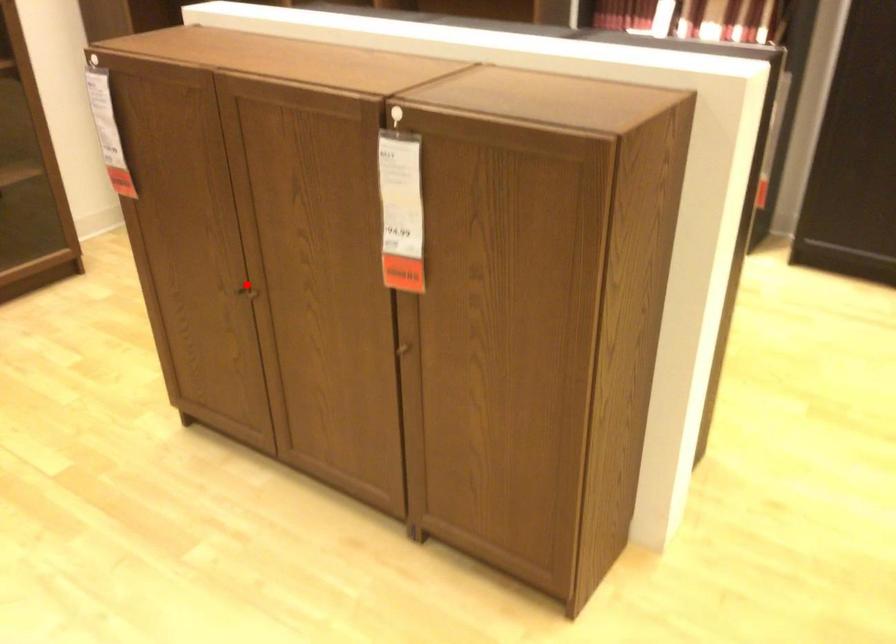
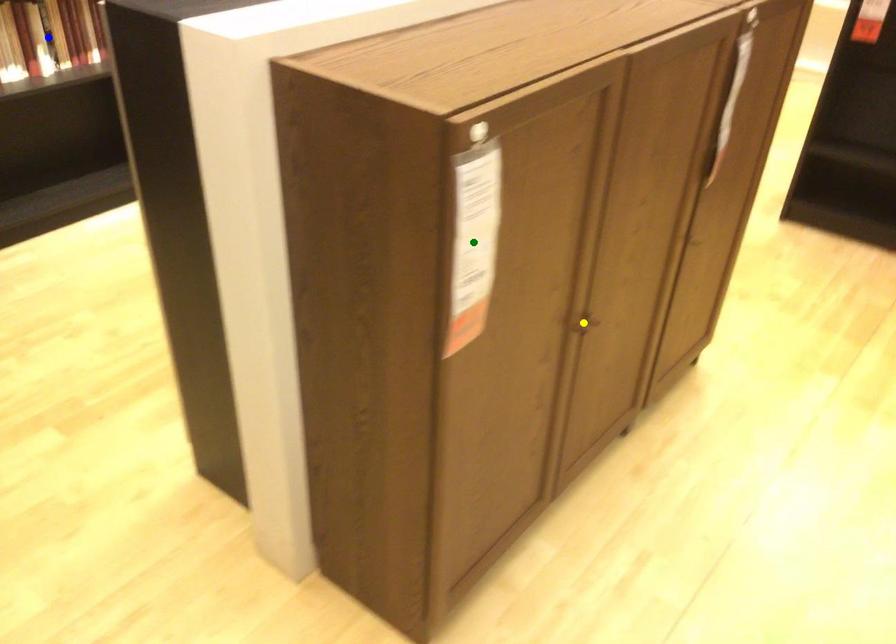
Question: I am providing you with two images of the same scene from different viewpoints. A red point is marked on the first image. You are given multiple points on the second image. Can you choose the point in image 2 that corresponds to the point in image 1?

Choices:
 (A) yellow point
 (B) green point
 (C) blue point

Answer: (A)